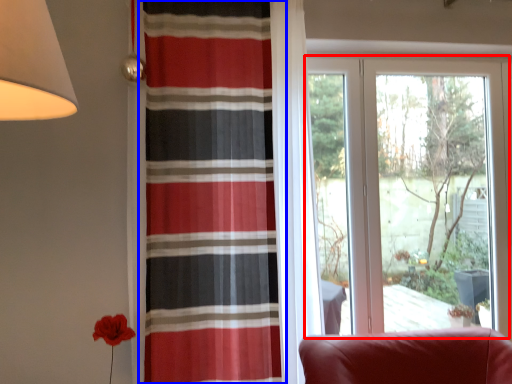
Question: Which object appears closest to the camera in this image, window (highlighted by a red box) or curtain (highlighted by a blue box)?

Choices:
 (A) window
 (B) curtain

Answer: (B)